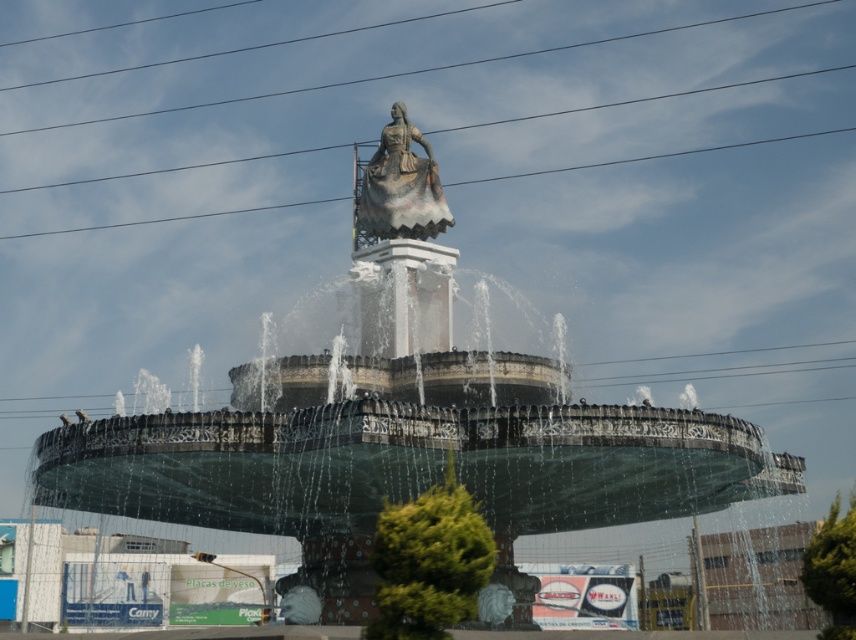
You are a photographer aiming to capture the polished bronze statue at center without any obstructions. However, there is a metallic wire at upper center in the frame. Based on their positions, can you adjust your camera angle to avoid the wire while still keeping the statue in view?

The metallic wire at upper center is closer to you than the polished bronze statue at center. By lowering your camera angle slightly, you can position the statue behind the wire, but this would still block the statue. Alternatively, moving to the side might allow you to position the statue so that the wire is out of frame. However, since the wire is in front of the statue, it will obstruct the view unless you can physically move around the fountain to a position where the wire is not between you and thestat

You are a photographer planning to capture the fountain and its surroundings. You notice the metallic wire at upper center and the polished bronze statue at center. Which object will appear taller in your photo?

The metallic wire at upper center is taller than the polished bronze statue at center, so it will appear taller in the photo.

You are a maintenance worker inspecting the fountain. You notice the metallic wire at upper center and the polished bronze statue at center. Which object is positioned to the right side of the other?

The metallic wire at upper center is to the right of the polished bronze statue at center, so the metallic wire at upper center is positioned to the right of the polished bronze statue at center.